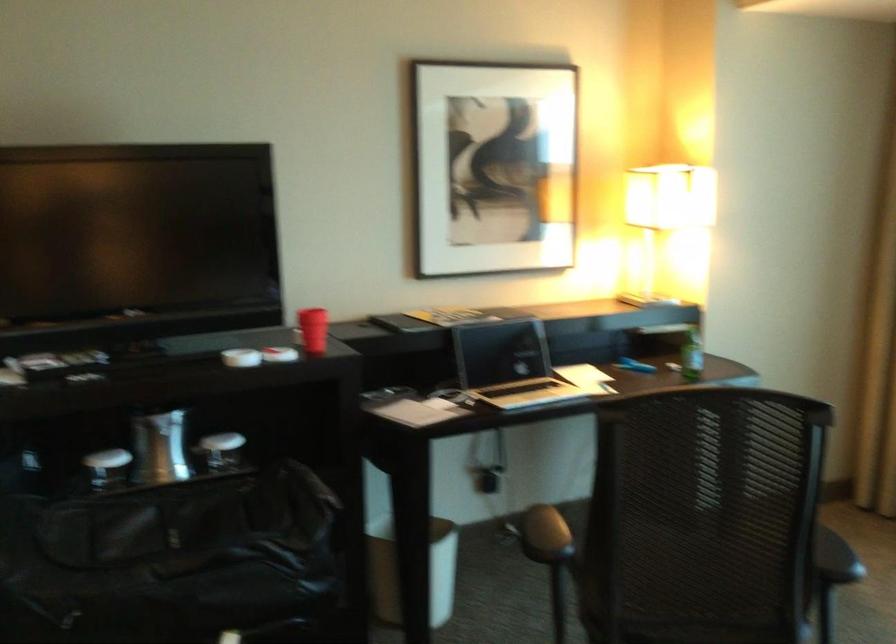
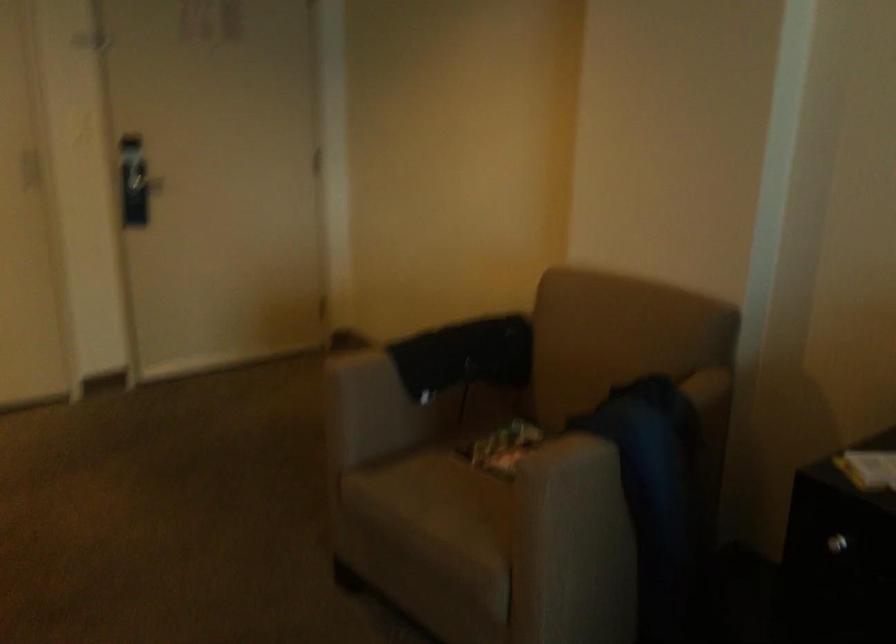
Question: How did the camera likely rotate?

Choices:
 (A) Left
 (B) Right
 (C) Up
 (D) Down

Answer: (A)